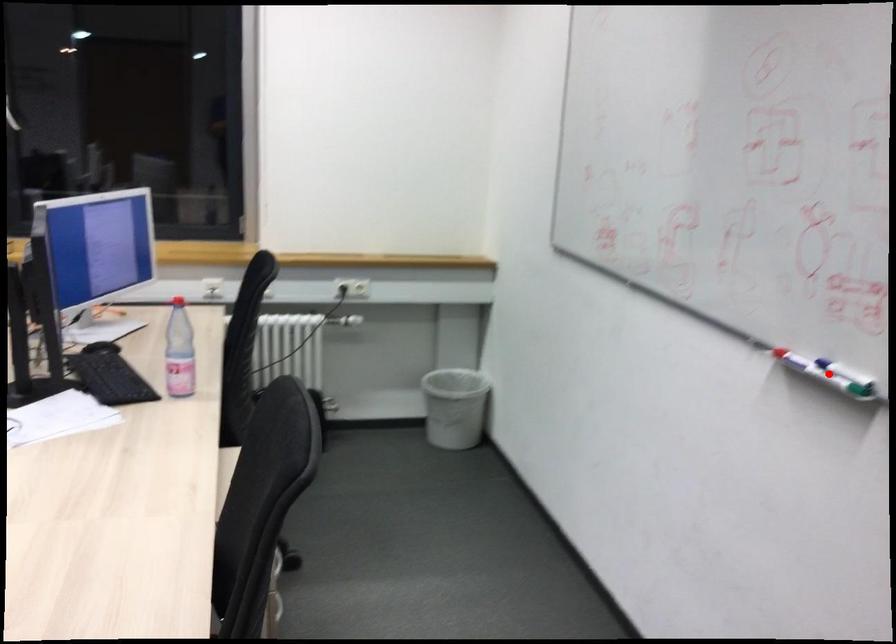
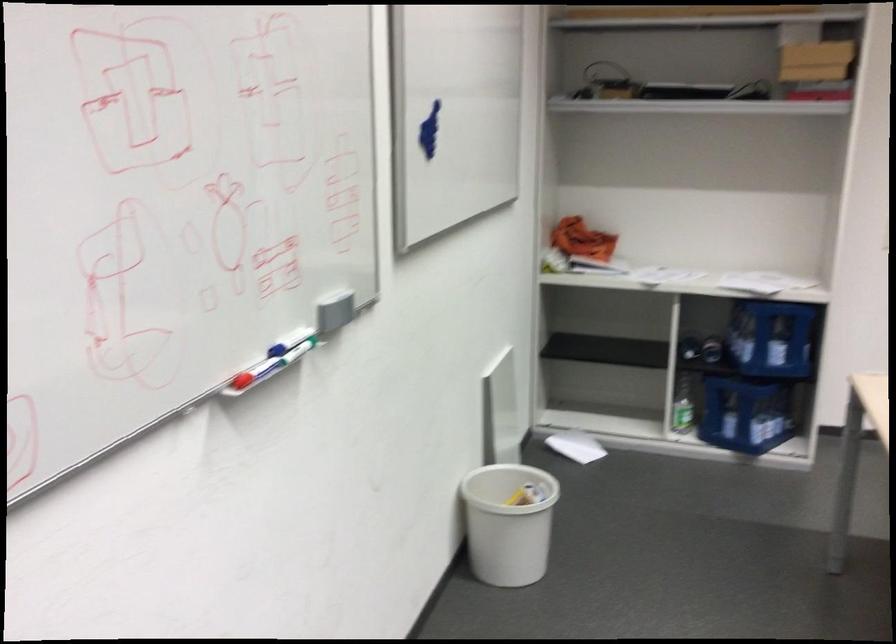
Question: I am providing you with two images of the same scene from different viewpoints. A red point is marked on the first image. Can you still see the location of the red point in image 2?

Choices:
 (A) Yes
 (B) No

Answer: (B)